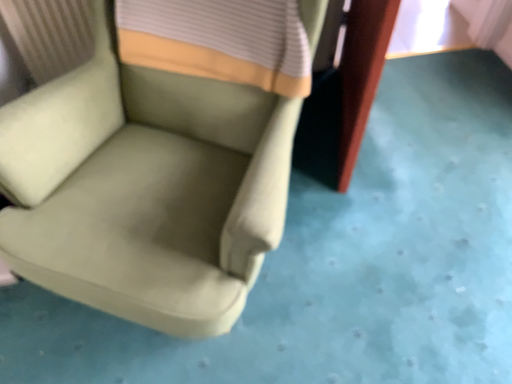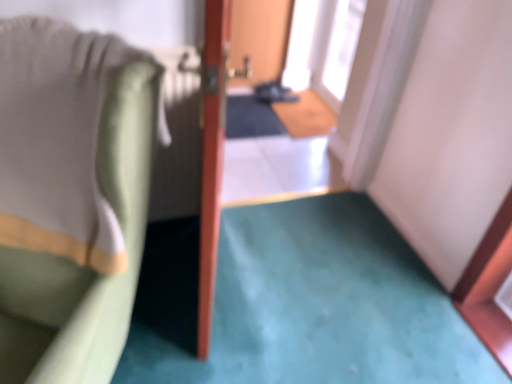
Question: Which way did the camera rotate in the video?

Choices:
 (A) rotated downward
 (B) rotated upward

Answer: (B)